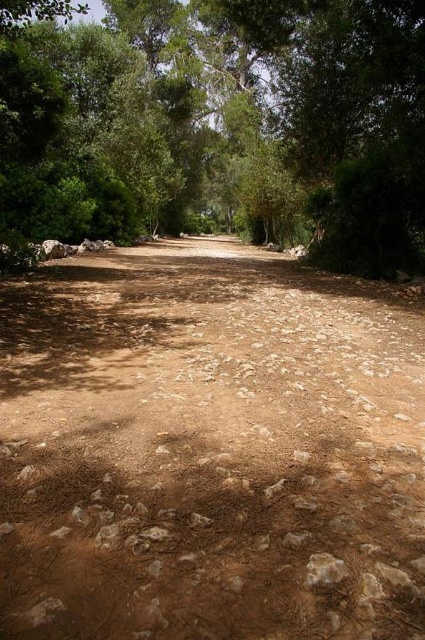
Question: Considering the real-world distances, which object is farthest from the brown rocky dirt track at center?

Choices:
 (A) brown rough stone at lower center
 (B) brown dirt road at center

Answer: (B)

Question: Does brown dirt road at center appear under brown rough stone at lower center?

Choices:
 (A) no
 (B) yes

Answer: (A)

Question: Which of the following is the closest to the observer?

Choices:
 (A) (312, 560)
 (B) (424, 61)

Answer: (A)

Question: Which of the following is the farthest from the observer?

Choices:
 (A) brown dirt road at center
 (B) brown rough stone at lower center
 (C) brown rocky dirt track at center

Answer: (A)

Question: Does brown rocky dirt track at center have a smaller size compared to brown rough stone at lower center?

Choices:
 (A) no
 (B) yes

Answer: (A)

Question: Can you confirm if brown rocky dirt track at center is bigger than brown dirt road at center?

Choices:
 (A) no
 (B) yes

Answer: (A)